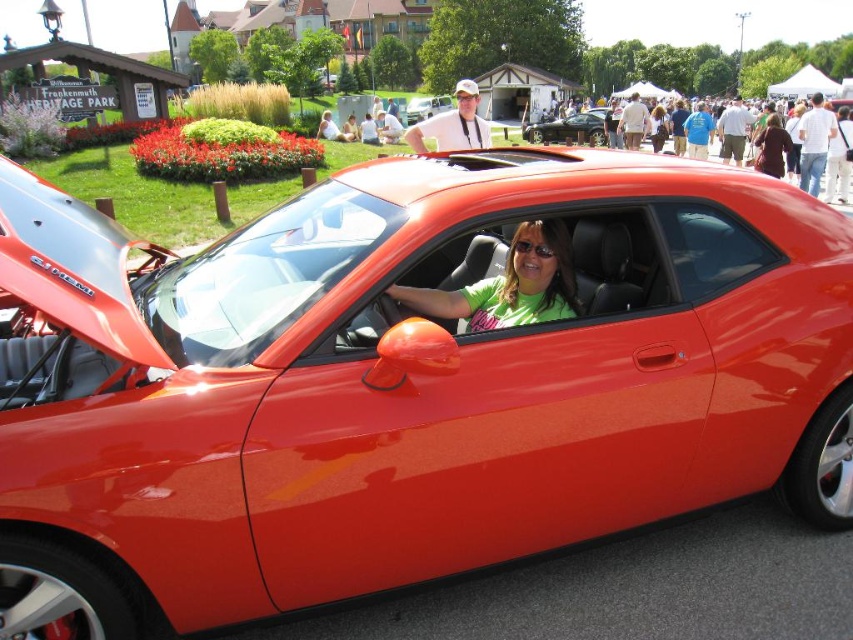
Looking at this image, you are a photographer standing at the edge of the garden, wanting to capture both the matte brown jacket at center and the glossy orange car at center in the same frame. Based on their distance apart, can you estimate if they can be included in a single photo without moving your position?

The matte brown jacket at center and glossy orange car at center are 34.82 meters apart. Since they are positioned at the same central area, their distance apart is likely within the camera lens range to be captured in a single frame without moving your position.

You are a photographer at the event and want to capture both the green matte shirt at center and the matte brown jacket at center in a single shot. Which object should you focus on first to ensure both are in frame?

The green matte shirt at center is not as tall as the matte brown jacket at center, so you should focus on the matte brown jacket at center first to ensure both are in frame since it is taller and will require more space in the composition.

You are a photographer trying to capture both the green matte shirt at center and the glossy orange car at center in a single shot. Based on their sizes, which object should you focus on first to ensure both are in frame?

The green matte shirt at center has a lesser width compared to glossy orange car at center, so you should focus on the glossy orange car at center first as it takes up more space in the frame, ensuring both objects are included.